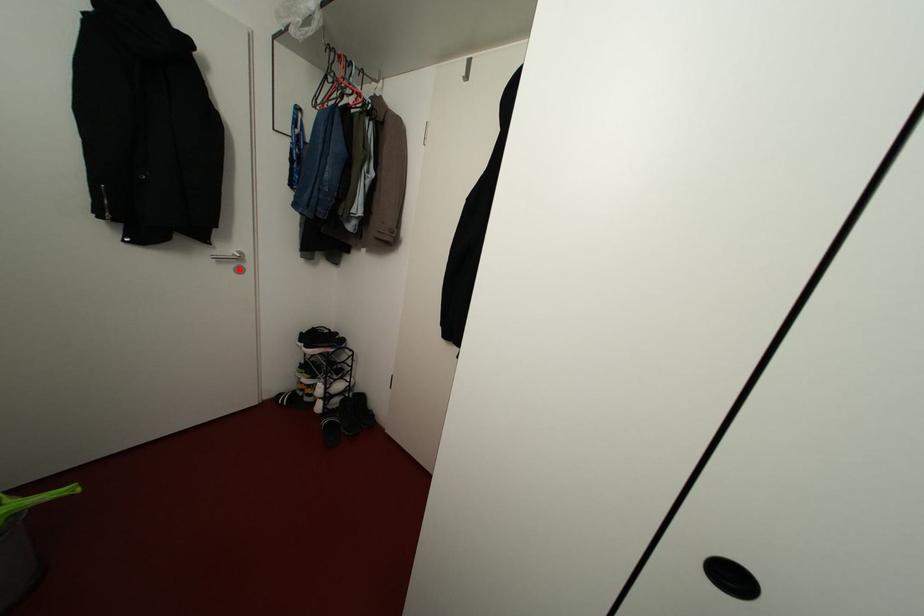
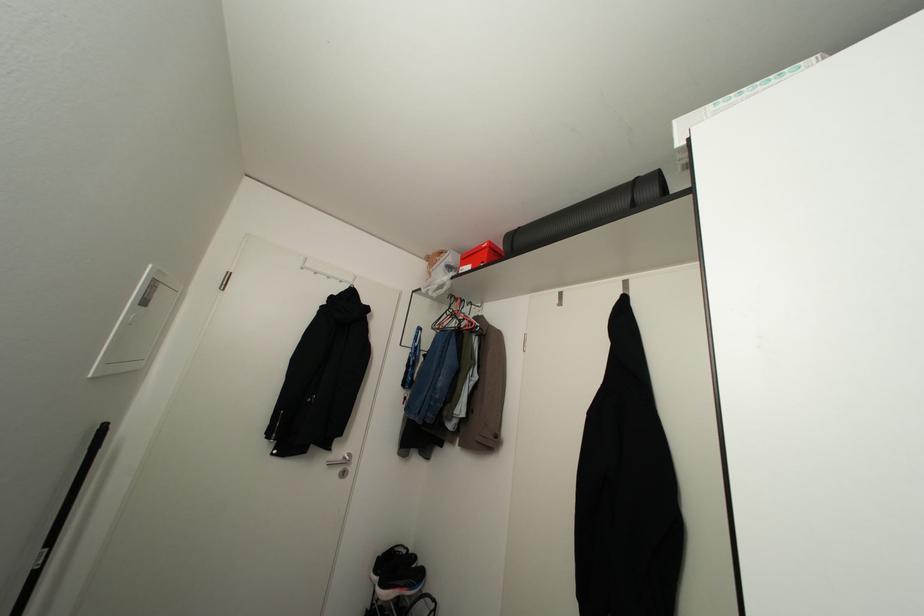
Question: I am providing you with two images of the same scene from different viewpoints. Image1 has a red point marked. In image2, the corresponding 3D location appears at what relative position? Reply with the corresponding letter.

Choices:
 (A) Closer
 (B) Farther

Answer: (B)